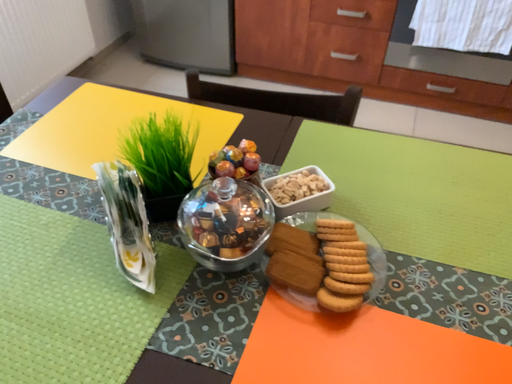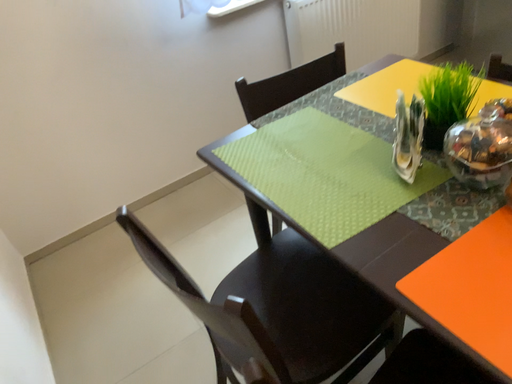
Question: How did the camera likely rotate when shooting the video?

Choices:
 (A) rotated right
 (B) rotated left

Answer: (B)